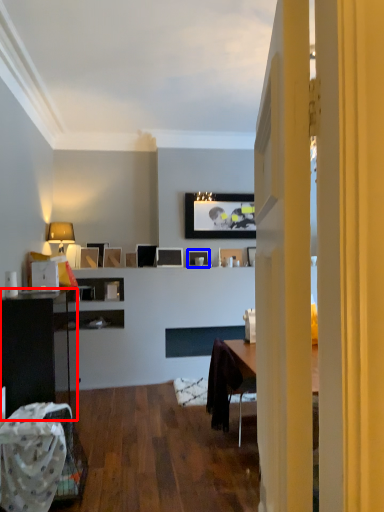
Question: Which point is further to the camera, cabinetry (highlighted by a red box) or picture frame (highlighted by a blue box)?

Choices:
 (A) cabinetry
 (B) picture frame

Answer: (B)